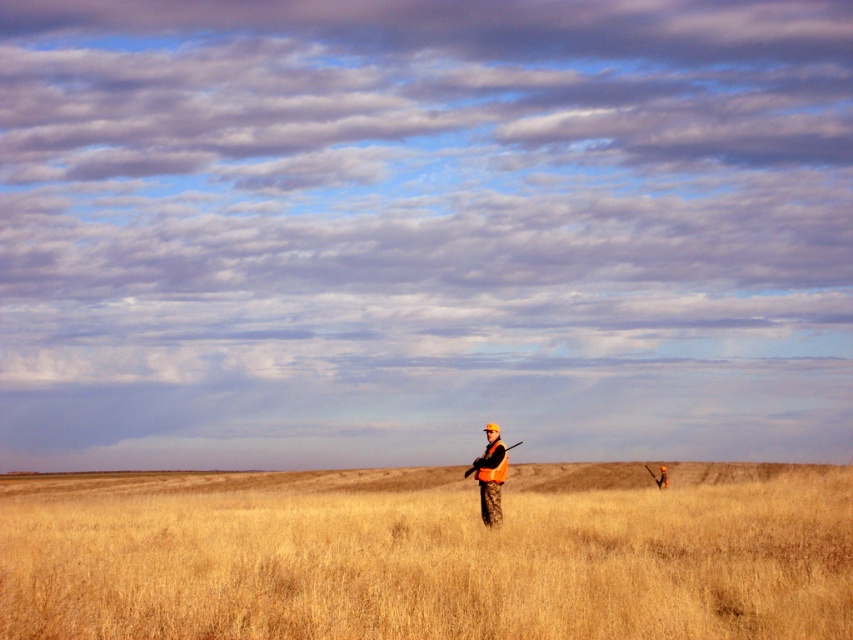
Consider the image. You are a hiker who wants to ensure visibility in the field. You have both a camouflage jacket at center and an orange reflective vest at center. Which clothing item should you wear to be more visible to others?

The orange reflective vest at center is more visible because it is designed for high visibility, whereas the camouflage jacket at center is meant to blend into the environment.

You are a hiker who spots a person in the field. You see the camouflage jacket at center and the orange reflective vest at center. Which piece of clothing is positioned to the left?

The camouflage jacket at center is to the left of the orange reflective vest at center.

You are the person in the field holding the long tool. You notice two distant points in the sky labeled as point (316,540) and point (495,483). Which point is closer to you?

Point (316,540) is in front of point (495,483), so it is closer to you.